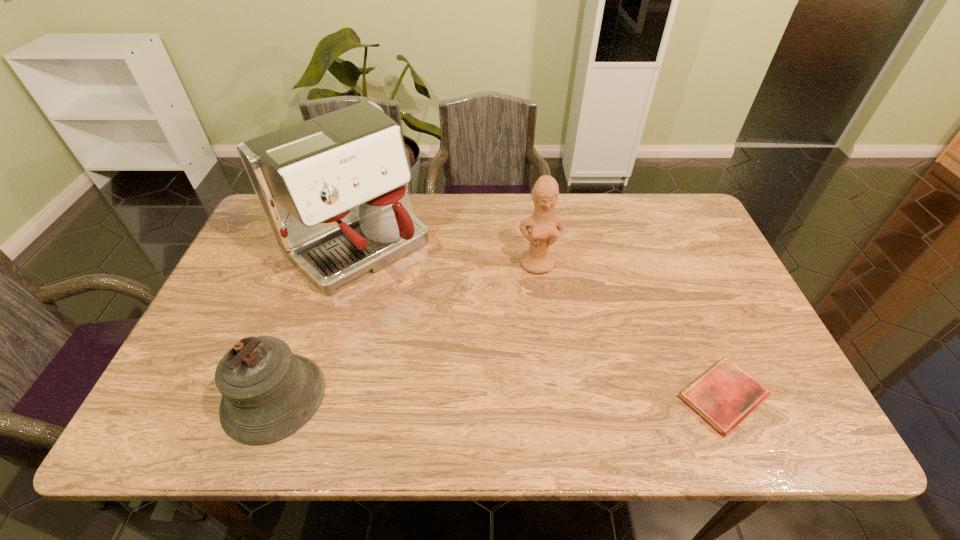
This screenshot has width=960, height=540. Find the location of `vacant space that satisfies the following two spatial constraints: 1. on the front side of the shortest object; 2. on the right side of the tallest object`. vacant space that satisfies the following two spatial constraints: 1. on the front side of the shortest object; 2. on the right side of the tallest object is located at coordinates (311, 396).

This screenshot has height=540, width=960. Identify the location of vacant space that satisfies the following two spatial constraints: 1. on the back side of the rightmost object; 2. on the left side of the second shortest object. (274, 396).

You are a GUI agent. You are given a task and a screenshot of the screen. Output one action in this format:
    pyautogui.click(x=<x>, y=<y>)
    Task: Click on the free location that satisfies the following two spatial constraints: 1. on the front side of the third shortest object; 2. on the left side of the coffee maker
    
    Given the screenshot: What is the action you would take?
    pyautogui.click(x=349, y=264)

Identify the location of free space that satisfies the following two spatial constraints: 1. on the front side of the tallest object; 2. on the left side of the shortest object. The width and height of the screenshot is (960, 540). (311, 396).